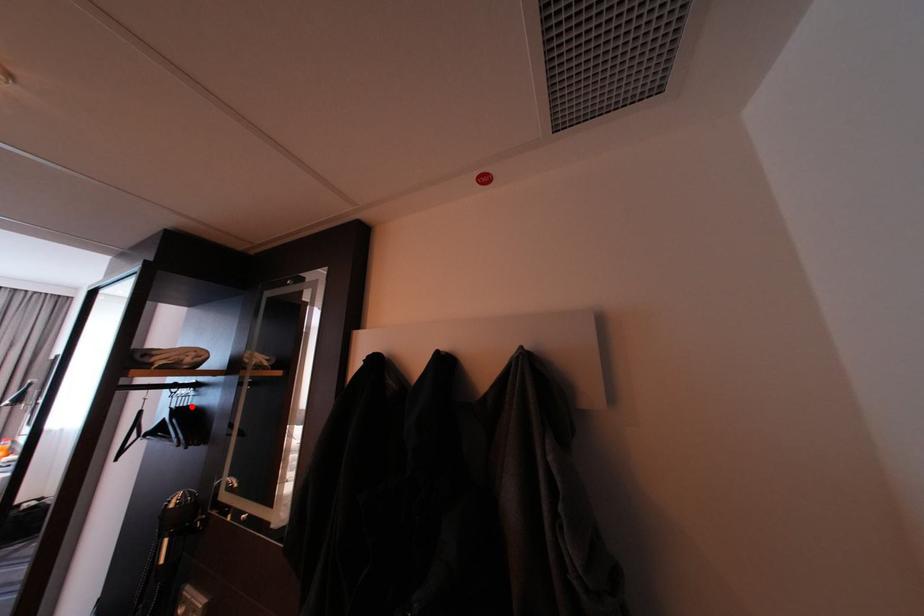
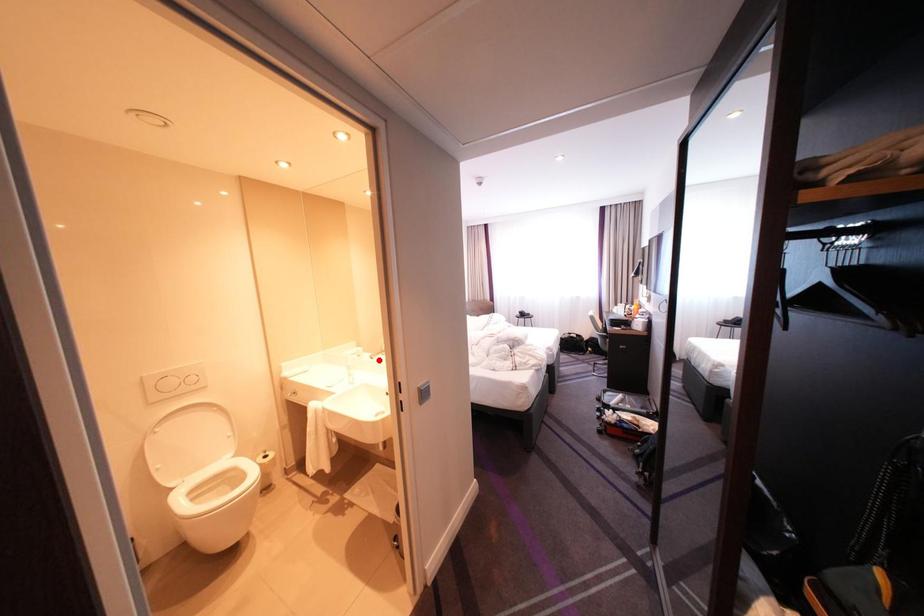
I am providing you with two images of the same scene from different viewpoints. A red point is marked on the first image and another point is marked on the second image. Is the red point in image1 aligned with the point shown in image2?

No